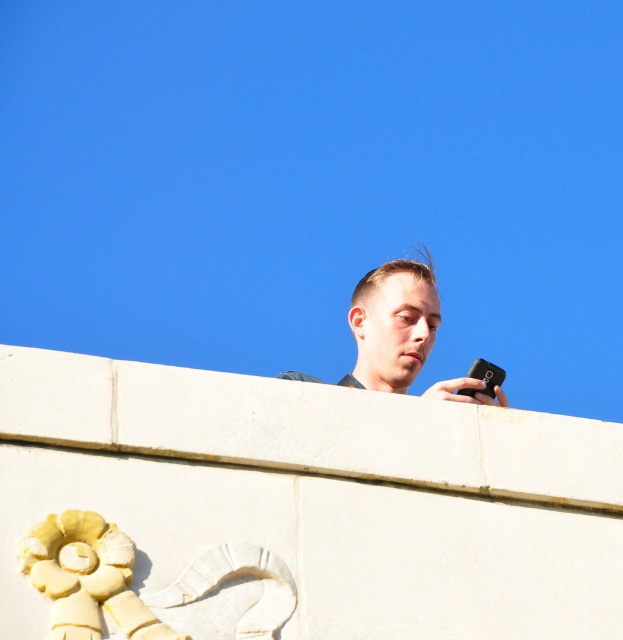
Is matte black phone at upper center positioned before black matte smartphone at upper right?

Yes.

This screenshot has width=623, height=640. In order to click on matte black phone at upper center in this screenshot , I will do `click(392, 323)`.

This screenshot has height=640, width=623. I want to click on matte black phone at upper center, so click(x=392, y=323).